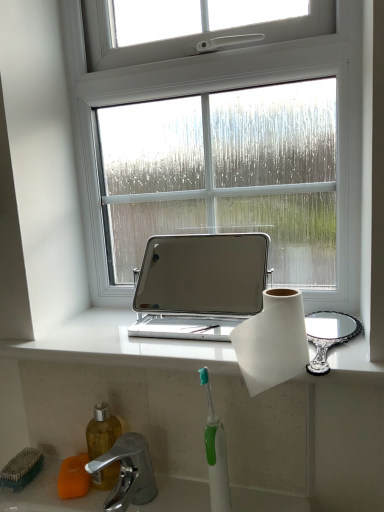
The width and height of the screenshot is (384, 512). I want to click on vacant region above white marble window sill at center (from a real-world perspective), so click(x=170, y=326).